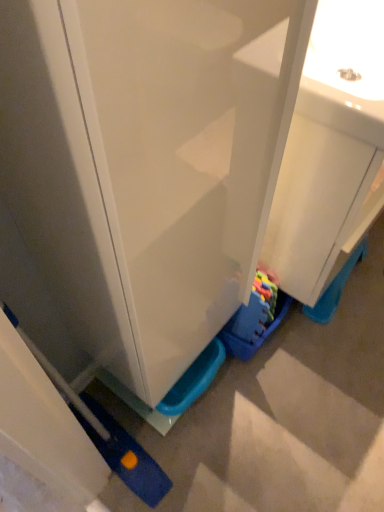
Question: Is white glossy sink at center behind matte white cabinet at center?

Choices:
 (A) yes
 (B) no

Answer: (A)

Question: Are white glossy sink at center and matte white cabinet at center far apart?

Choices:
 (A) yes
 (B) no

Answer: (B)

Question: From a real-world perspective, does white glossy sink at center stand above matte white cabinet at center?

Choices:
 (A) yes
 (B) no

Answer: (B)

Question: From the image's perspective, is white glossy sink at center below matte white cabinet at center?

Choices:
 (A) yes
 (B) no

Answer: (B)

Question: Is white glossy sink at center looking in the opposite direction of matte white cabinet at center?

Choices:
 (A) no
 (B) yes

Answer: (A)

Question: From the image's perspective, is white glossy sink at center over matte white cabinet at center?

Choices:
 (A) no
 (B) yes

Answer: (B)

Question: From the image's perspective, is rubberized plastic toy at lower center located beneath matte white cabinet at center?

Choices:
 (A) yes
 (B) no

Answer: (B)

Question: Could you tell me if rubberized plastic toy at lower center is facing matte white cabinet at center?

Choices:
 (A) no
 (B) yes

Answer: (A)

Question: Is matte white cabinet at center a part of rubberized plastic toy at lower center?

Choices:
 (A) no
 (B) yes

Answer: (A)

Question: Would you say rubberized plastic toy at lower center is outside matte white cabinet at center?

Choices:
 (A) yes
 (B) no

Answer: (A)

Question: Is rubberized plastic toy at lower center facing away from matte white cabinet at center?

Choices:
 (A) no
 (B) yes

Answer: (A)

Question: Does rubberized plastic toy at lower center have a lesser height compared to matte white cabinet at center?

Choices:
 (A) yes
 (B) no

Answer: (A)

Question: Is white glossy sink at center completely or partially inside matte white cabinet at center?

Choices:
 (A) yes
 (B) no

Answer: (B)